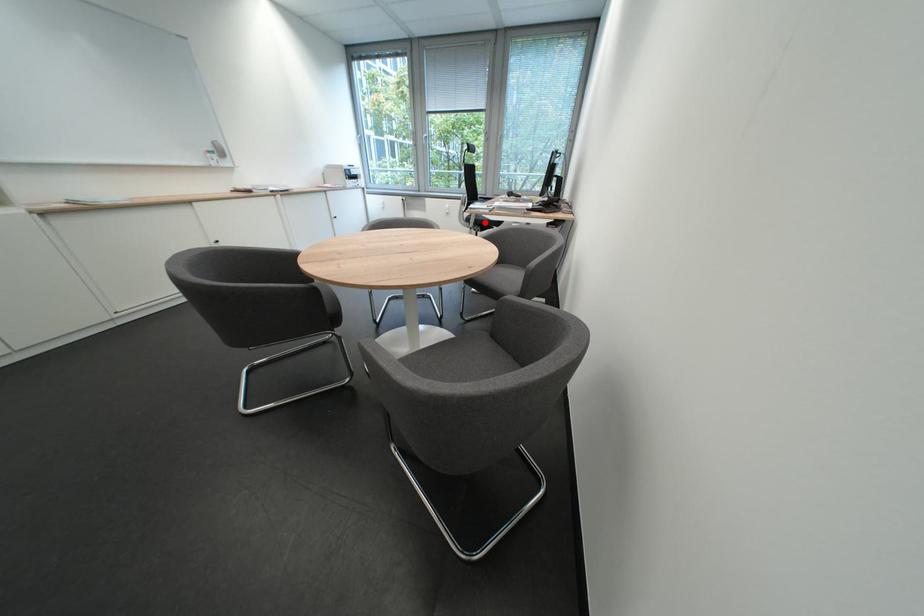
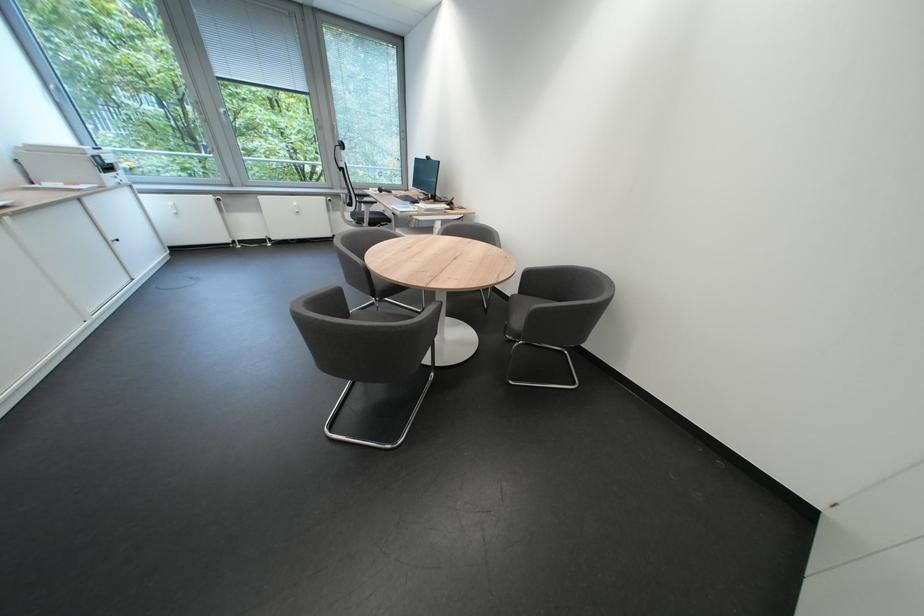
Find the pixel in the second image that matches the highlighted location in the first image.

(379, 222)